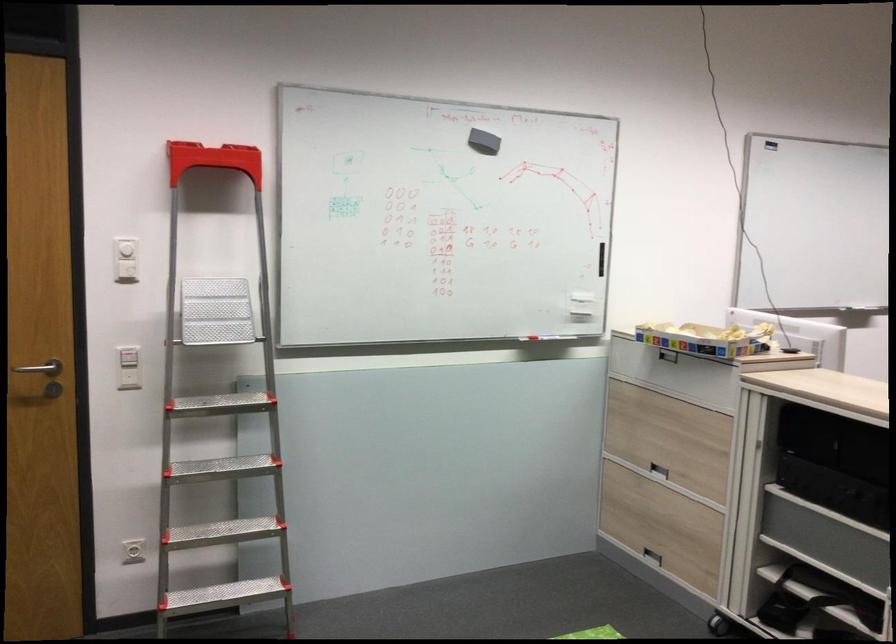
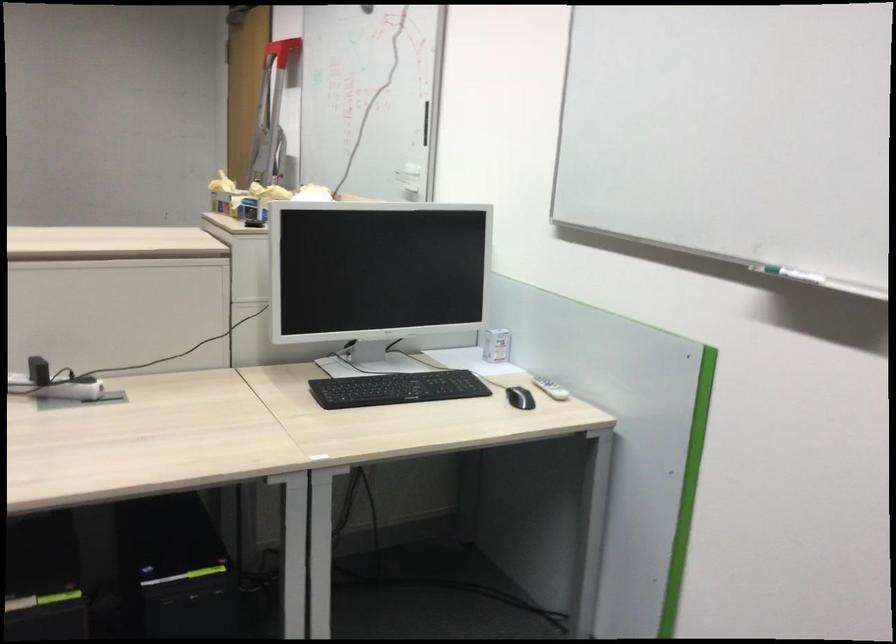
Question: I am providing you with two images of the same scene from different viewpoints. After the viewpoint changes to image2, which objects are now occluded?

Choices:
 (A) silver door handle
 (B) white remote control
 (C) white power adapter
 (D) beige throw blanket

Answer: (A)